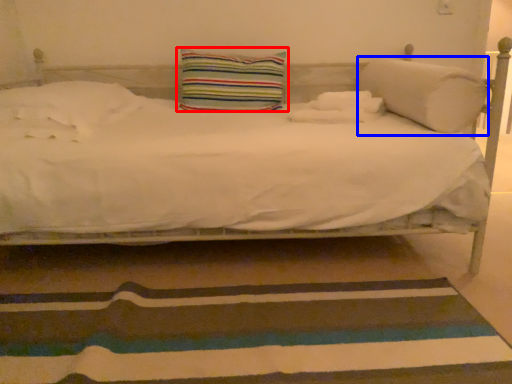
Question: Which of the following is the farthest to the observer, pillow (highlighted by a red box) or pillow (highlighted by a blue box)?

Choices:
 (A) pillow
 (B) pillow

Answer: (A)